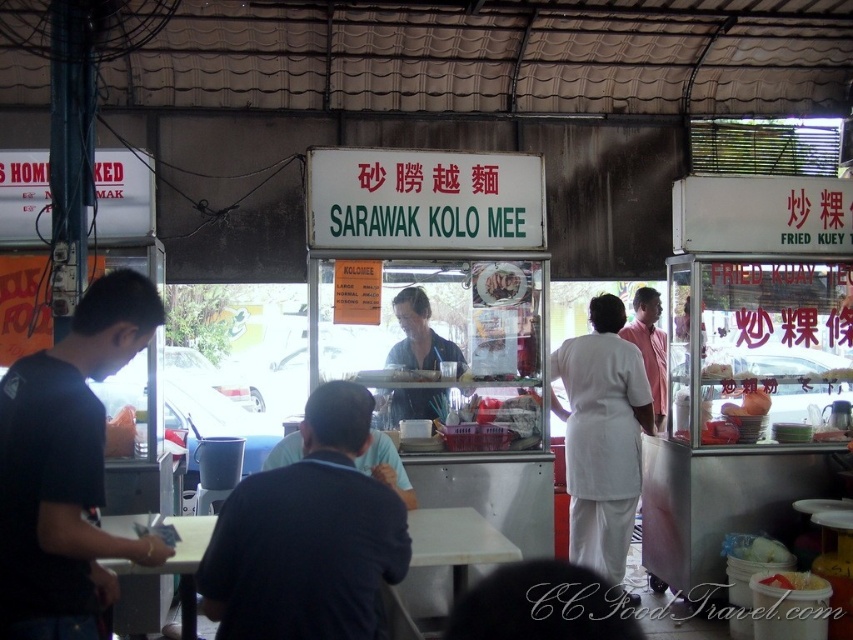
Does dark blue shirt at center have a lesser width compared to pink cotton shirt at center?

No, dark blue shirt at center is not thinner than pink cotton shirt at center.

Between point (325, 458) and point (641, 324), which one is positioned behind?

The point (641, 324) is behind.

You are a GUI agent. You are given a task and a screenshot of the screen. Output one action in this format:
    pyautogui.click(x=<x>, y=<y>)
    Task: Click on the dark blue shirt at center
    The width and height of the screenshot is (853, 640).
    Given the screenshot: What is the action you would take?
    pyautogui.click(x=308, y=536)

Where is `dark blue shirt at center`? The image size is (853, 640). dark blue shirt at center is located at coordinates (308, 536).

Where is `blue shirt at center`? blue shirt at center is located at coordinates (421, 337).

Does blue shirt at center have a lesser height compared to pink cotton shirt at center?

Indeed, blue shirt at center has a lesser height compared to pink cotton shirt at center.

Which is behind, point (395, 394) or point (664, 371)?

Positioned behind is point (664, 371).

Where is `blue shirt at center`? This screenshot has height=640, width=853. blue shirt at center is located at coordinates (421, 337).

Between white fabric shirt at center and white matte rice at center, which one has more height?

Standing taller between the two is white fabric shirt at center.

Measure the distance between point (596, 349) and camera.

Point (596, 349) is 5.14 meters away from camera.

In order to click on white fabric shirt at center in this screenshot , I will do `click(602, 436)`.